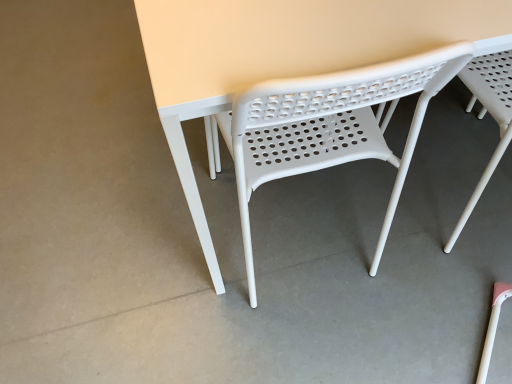
The height and width of the screenshot is (384, 512). I want to click on vacant area to the left of white plastic chair at center, so click(154, 241).